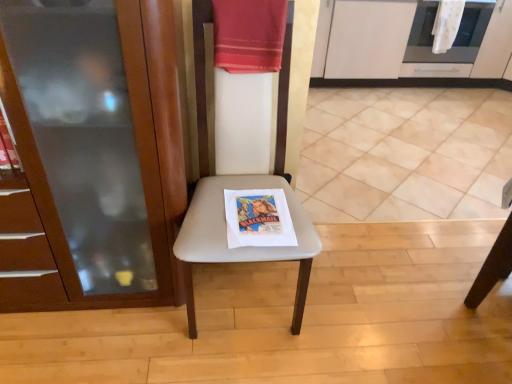
Question: Is beige fabric chair at center not near red cotton towel at upper center, acting as the first beach towel starting from the bottom?

Choices:
 (A) no
 (B) yes

Answer: (A)

Question: From the image's perspective, is beige fabric chair at center beneath red cotton towel at upper center, marked as the first beach towel in a front-to-back arrangement?

Choices:
 (A) no
 (B) yes

Answer: (B)

Question: Does beige fabric chair at center have a greater height compared to red cotton towel at upper center, the 2th beach towel when ordered from top to bottom?

Choices:
 (A) yes
 (B) no

Answer: (A)

Question: Does beige fabric chair at center have a greater width compared to red cotton towel at upper center, the 2th beach towel when ordered from top to bottom?

Choices:
 (A) yes
 (B) no

Answer: (A)

Question: From a real-world perspective, is beige fabric chair at center positioned under red cotton towel at upper center, marked as the first beach towel in a front-to-back arrangement, based on gravity?

Choices:
 (A) no
 (B) yes

Answer: (B)

Question: Is point (34, 170) closer or farther from the camera than point (217, 41)?

Choices:
 (A) closer
 (B) farther

Answer: (A)

Question: Which is correct: matte wood cabinet at left, which is the 1th cabinetry from front to back, is inside red cotton towel at upper center, acting as the 2th beach towel starting from the right, or outside of it?

Choices:
 (A) outside
 (B) inside

Answer: (A)

Question: Considering the positions of matte wood cabinet at left, which is the 1th cabinetry from front to back, and red cotton towel at upper center, the second beach towel viewed from the back, in the image, is matte wood cabinet at left, which is the 1th cabinetry from front to back, wider or thinner than red cotton towel at upper center, the second beach towel viewed from the back,?

Choices:
 (A) wide
 (B) thin

Answer: (A)

Question: From a real-world perspective, relative to red cotton towel at upper center, the 2th beach towel when ordered from top to bottom, is matte wood cabinet at left, the second cabinetry in the right-to-left sequence, vertically above or below?

Choices:
 (A) below
 (B) above

Answer: (A)

Question: In terms of height, does stainless steel oven at upper right look taller or shorter compared to white textured towel at upper right, the first beach towel from the top?

Choices:
 (A) short
 (B) tall

Answer: (B)

Question: Is point (464, 28) positioned closer to the camera than point (456, 23)?

Choices:
 (A) closer
 (B) farther

Answer: (B)

Question: Based on their sizes in the image, would you say stainless steel oven at upper right is bigger or smaller than white textured towel at upper right, the first beach towel from the top?

Choices:
 (A) big
 (B) small

Answer: (A)

Question: Considering their positions, is stainless steel oven at upper right located in front of or behind white textured towel at upper right, the 1th beach towel in the right-to-left sequence?

Choices:
 (A) behind
 (B) front

Answer: (A)

Question: Is point (192, 304) positioned closer to the camera than point (452, 13)?

Choices:
 (A) closer
 (B) farther

Answer: (A)

Question: From a real-world perspective, relative to white textured towel at upper right, the second beach towel in the left-to-right sequence, is beige fabric chair at center vertically above or below?

Choices:
 (A) above
 (B) below

Answer: (A)